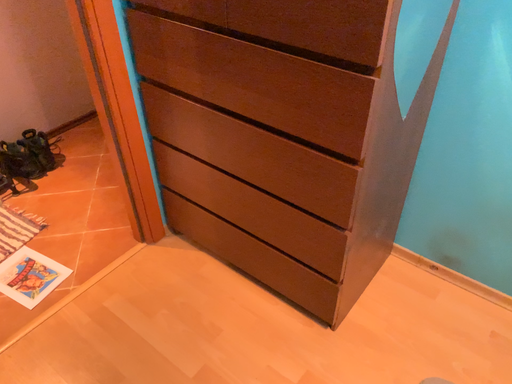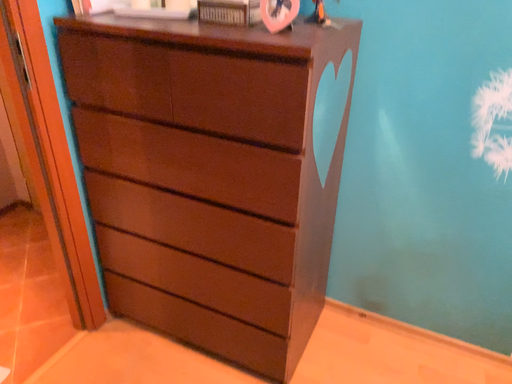
Question: How did the camera likely rotate when shooting the video?

Choices:
 (A) rotated upward
 (B) rotated downward

Answer: (A)